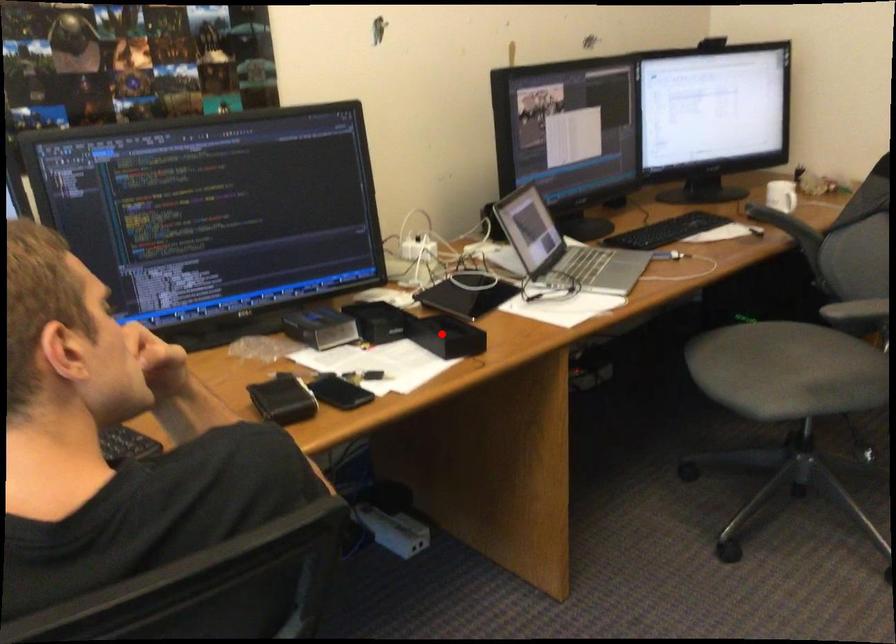
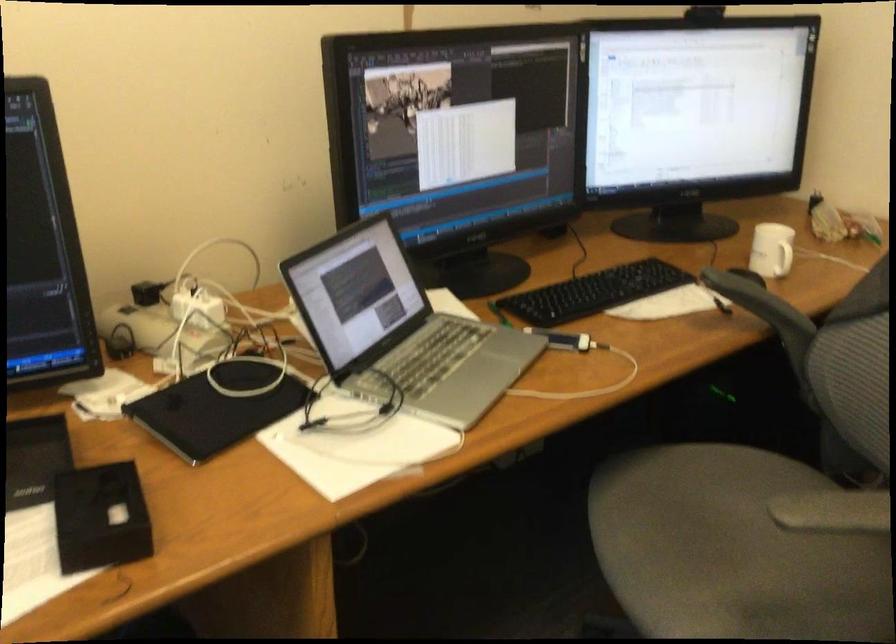
Find the pixel in the second image that matches the highlighted location in the first image.

(100, 518)